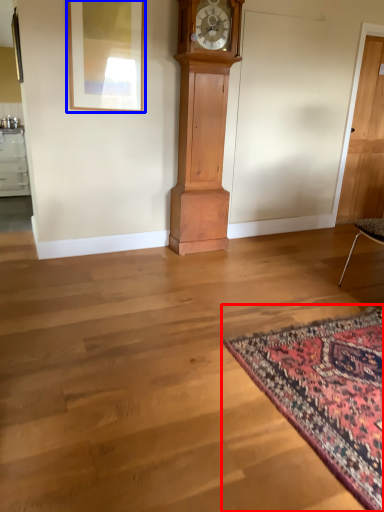
Question: Among these objects, which one is nearest to the camera, mat (highlighted by a red box) or picture frame (highlighted by a blue box)?

Choices:
 (A) mat
 (B) picture frame

Answer: (A)